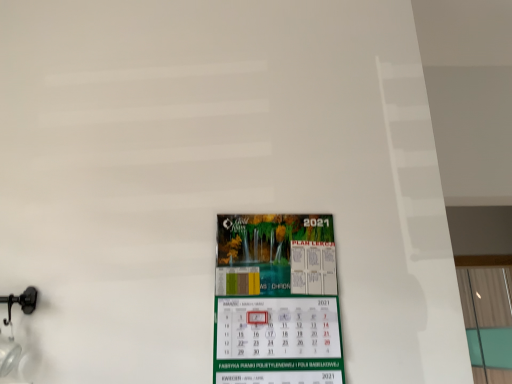
Question: Is transparent glass window at right behind green paper calendar at center?

Choices:
 (A) yes
 (B) no

Answer: (A)

Question: From the image's perspective, would you say transparent glass window at right is shown under green paper calendar at center?

Choices:
 (A) yes
 (B) no

Answer: (A)

Question: Is transparent glass window at right oriented away from green paper calendar at center?

Choices:
 (A) no
 (B) yes

Answer: (A)

Question: Does transparent glass window at right appear on the left side of green paper calendar at center?

Choices:
 (A) no
 (B) yes

Answer: (A)

Question: Considering the relative sizes of transparent glass window at right and green paper calendar at center in the image provided, is transparent glass window at right thinner than green paper calendar at center?

Choices:
 (A) no
 (B) yes

Answer: (A)

Question: Is transparent glass window at right oriented towards green paper calendar at center?

Choices:
 (A) no
 (B) yes

Answer: (A)

Question: Does green paper calendar at center lie behind transparent glass window at right?

Choices:
 (A) yes
 (B) no

Answer: (B)

Question: From a real-world perspective, is green paper calendar at center over transparent glass window at right?

Choices:
 (A) no
 (B) yes

Answer: (A)

Question: Is green paper calendar at center to the left of transparent glass window at right from the viewer's perspective?

Choices:
 (A) yes
 (B) no

Answer: (A)

Question: Are green paper calendar at center and transparent glass window at right far apart?

Choices:
 (A) yes
 (B) no

Answer: (A)

Question: Is green paper calendar at center at the right side of transparent glass window at right?

Choices:
 (A) yes
 (B) no

Answer: (B)

Question: Can you confirm if green paper calendar at center is wider than transparent glass window at right?

Choices:
 (A) no
 (B) yes

Answer: (A)

Question: Is point (260, 241) closer or farther from the camera than point (493, 326)?

Choices:
 (A) farther
 (B) closer

Answer: (B)